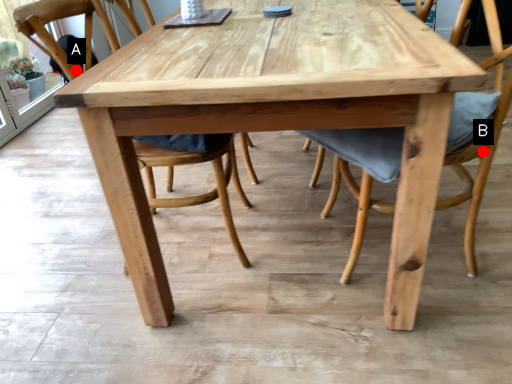
Question: Two points are circled on the image, labeled by A and B beside each circle. Which of the following is the farthest from the observer?

Choices:
 (A) A is further
 (B) B is further

Answer: (A)